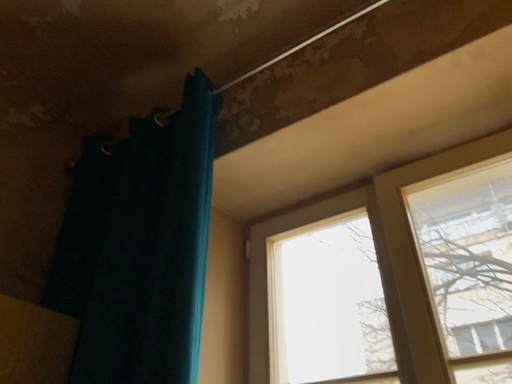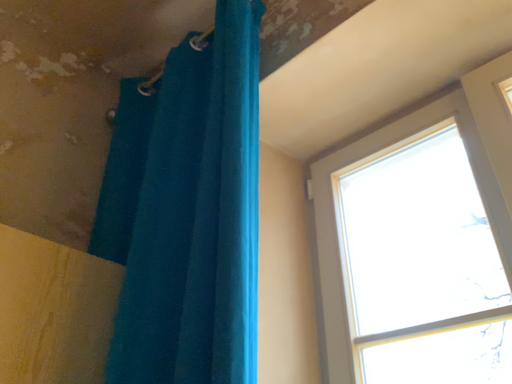
Question: Which way did the camera rotate in the video?

Choices:
 (A) rotated right
 (B) rotated left

Answer: (B)